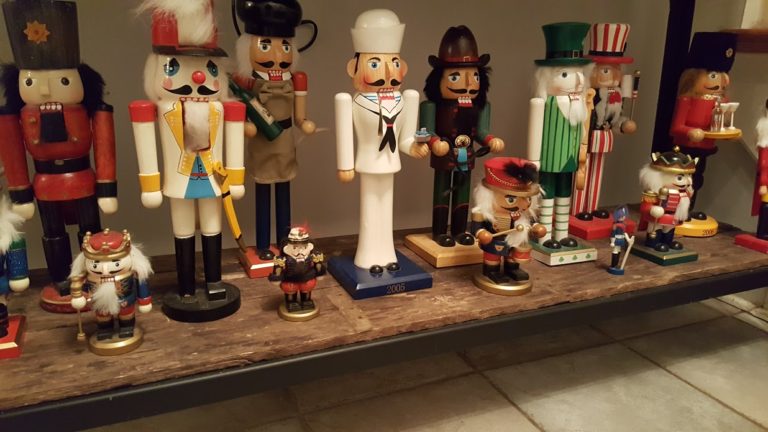
Where is `table`? This screenshot has height=432, width=768. table is located at coordinates (429, 312).